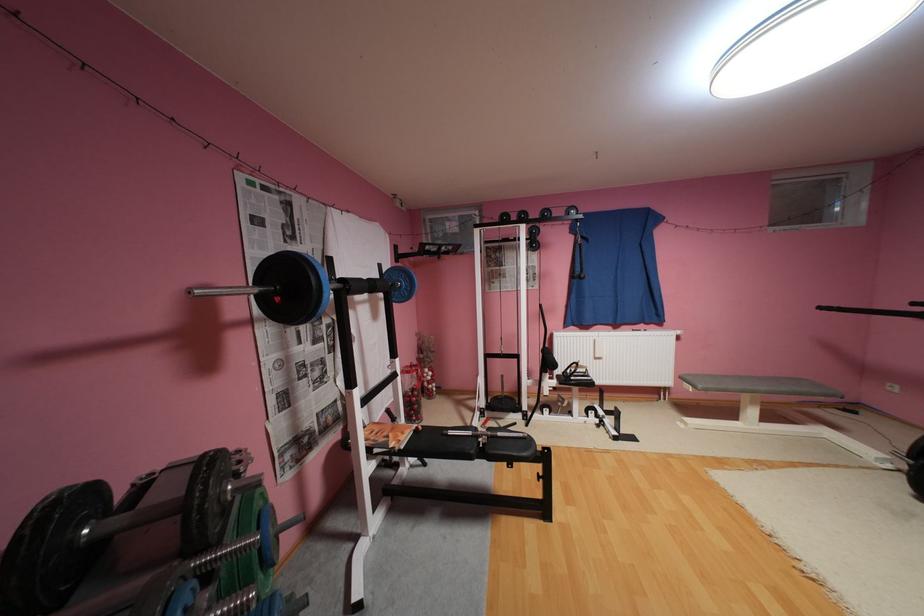
Find where to grip the dumbbell handle. Please return your answer as a coordinate pair (x, y).

(113, 528)